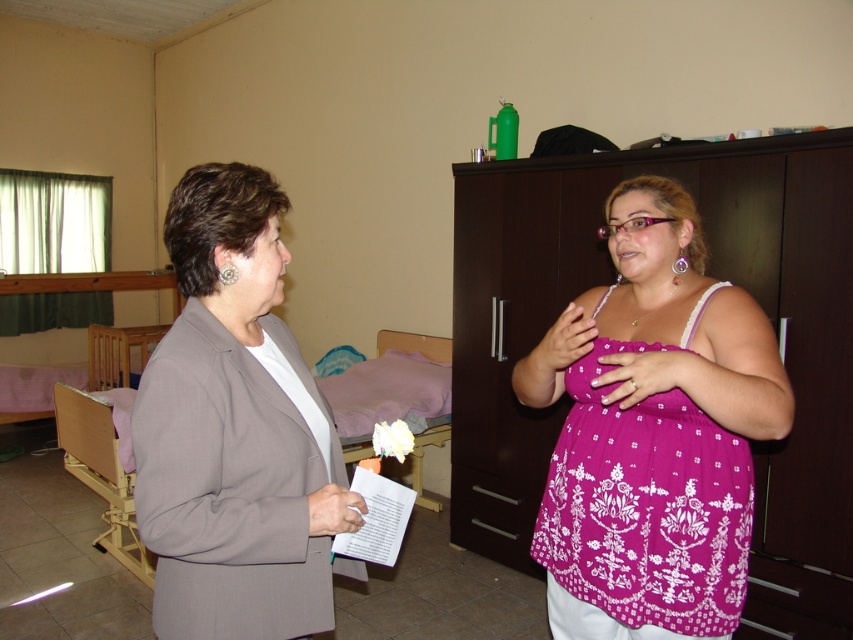
Between purple printed blouse at center and matte gray blazer at center, which one has less height?

matte gray blazer at center is shorter.

Describe the element at coordinates (653, 433) in the screenshot. This screenshot has height=640, width=853. I see `purple printed blouse at center` at that location.

Does point (635, 612) come behind point (161, 442)?

That is True.

The width and height of the screenshot is (853, 640). I want to click on purple printed blouse at center, so click(x=653, y=433).